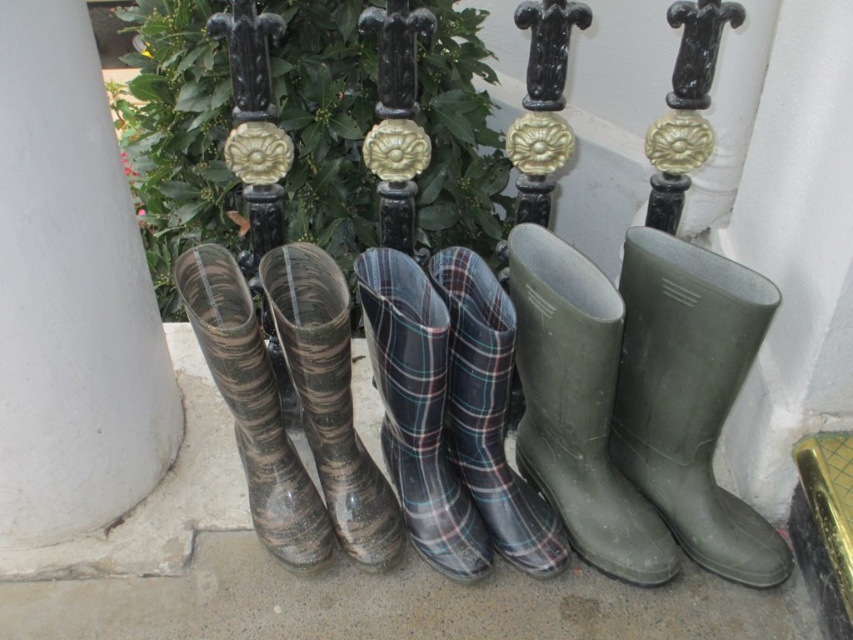
Question: Does plaid rubber boots at center have a smaller size compared to camouflage rubber boots at left?

Choices:
 (A) no
 (B) yes

Answer: (B)

Question: Can you confirm if green rubber boot at right is positioned to the left of green rubber boot at center?

Choices:
 (A) no
 (B) yes

Answer: (A)

Question: Can you confirm if white concrete pillar at lower left is thinner than camouflage rubber boots at left?

Choices:
 (A) no
 (B) yes

Answer: (A)

Question: Which object appears farthest from the camera in this image?

Choices:
 (A) plaid rubber boot at center
 (B) camouflage rubber boots at left
 (C) green rubber boot at right
 (D) white concrete pillar at lower left

Answer: (A)

Question: Which of the following is the closest to the observer?

Choices:
 (A) (486, 477)
 (B) (70, 385)
 (C) (318, 400)

Answer: (B)

Question: Which point is closer to the camera taking this photo?

Choices:
 (A) (616, 365)
 (B) (480, 449)
 (C) (120, 176)
 (D) (305, 531)

Answer: (A)